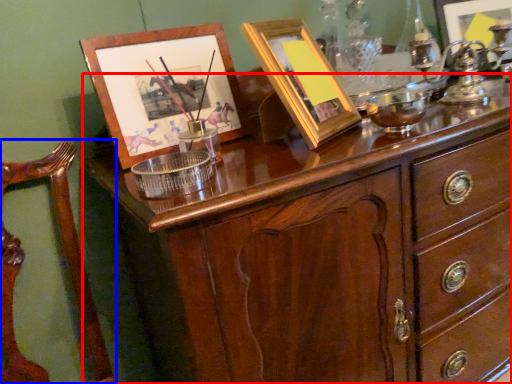
Question: Which point is further to the camera, chest of drawers (highlighted by a red box) or armchair (highlighted by a blue box)?

Choices:
 (A) chest of drawers
 (B) armchair

Answer: (A)